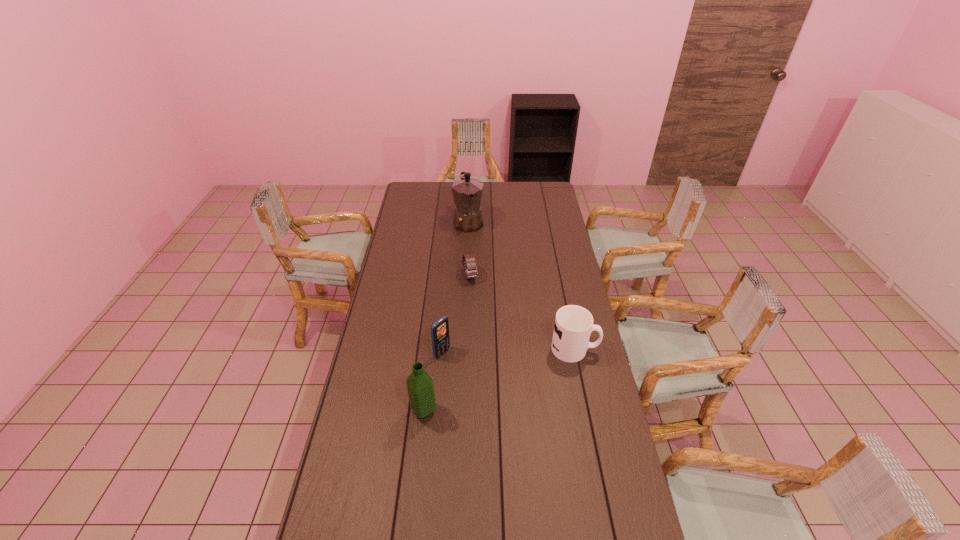
Where is `free space on the desktop that is between the water bottle and the rightmost object and is positioned on the pouring side of the farthest object`? The image size is (960, 540). free space on the desktop that is between the water bottle and the rightmost object and is positioned on the pouring side of the farthest object is located at coordinates (522, 370).

Locate an element on the screen. This screenshot has width=960, height=540. free spot on the desktop that is between the second tallest object and the mug and is positioned on the screen of the cellular telephone is located at coordinates (x=486, y=385).

Where is `free spot on the desktop that is between the water bottle and the mug and is positioned on the face of the shortest object`? This screenshot has width=960, height=540. free spot on the desktop that is between the water bottle and the mug and is positioned on the face of the shortest object is located at coordinates (505, 377).